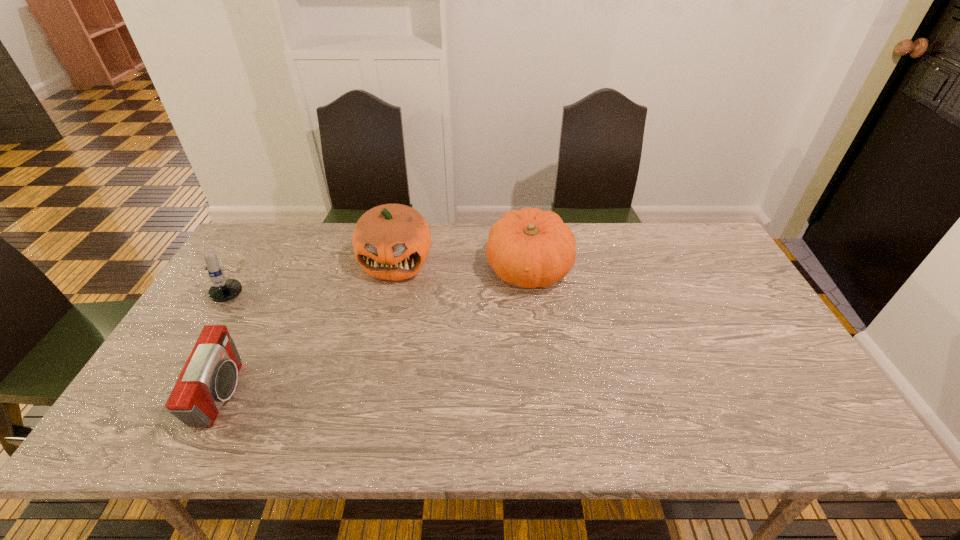
What are the coordinates of `object positioned at the near edge` in the screenshot? It's located at (209, 378).

Identify the location of microphone present at the left edge. (223, 290).

Find the location of a particular element. This screenshot has height=540, width=960. camera that is at the left edge is located at coordinates (209, 378).

The width and height of the screenshot is (960, 540). What are the coordinates of `object at the far left corner` in the screenshot? It's located at (223, 290).

Where is `object that is at the near left corner`? The width and height of the screenshot is (960, 540). object that is at the near left corner is located at coordinates (209, 378).

Where is `free space at the far edge of the desktop`? free space at the far edge of the desktop is located at coordinates (315, 241).

Identify the location of vacant space at the near edge of the desktop. (711, 411).

This screenshot has height=540, width=960. In order to click on free space at the left edge in this screenshot , I will do `click(200, 322)`.

You are a GUI agent. You are given a task and a screenshot of the screen. Output one action in this format:
    pyautogui.click(x=<x>, y=<y>)
    Task: Click on the free spot at the right edge of the desktop
    This screenshot has width=960, height=540.
    Given the screenshot: What is the action you would take?
    pyautogui.click(x=765, y=378)

This screenshot has height=540, width=960. Identify the location of vacant area at the near right corner. [822, 437].